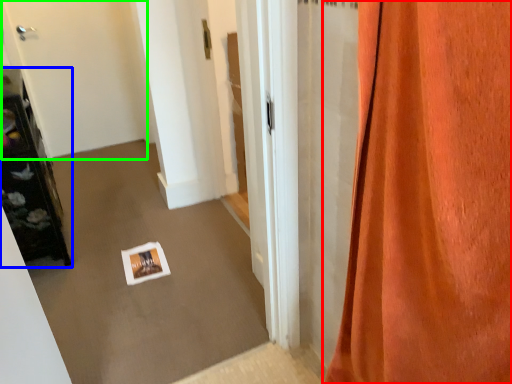
Question: Which object is the closest to the curtain (highlighted by a red box)? Choose among these: furniture (highlighted by a blue box) or door (highlighted by a green box).

Choices:
 (A) furniture
 (B) door

Answer: (A)